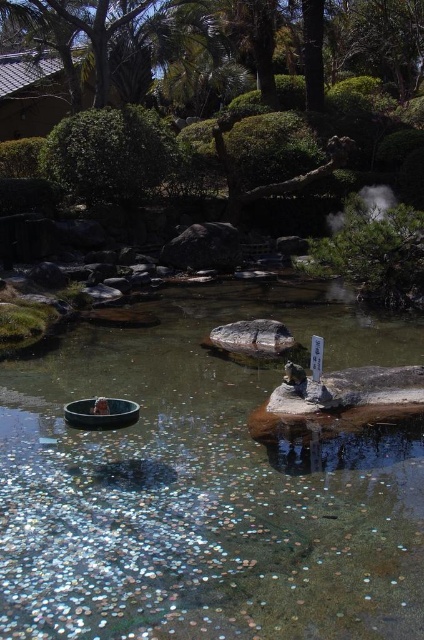
You are a visitor at the hot spring and want to place a small souvenir on the rocks near the water. Which rock would be more stable for placing your souvenir, the dark gray rock at center or the smooth gray rock at center?

The dark gray rock at center is larger and therefore more stable for placing your souvenir compared to the smooth gray rock at center.

You are a visitor at this hot spring and want to place a small offering into the clear glass water at center. However, you notice the dark gray rock at center nearby. Which object is larger in size, making it more suitable for placing larger offerings?

The dark gray rock at center is larger than the clear glass water at center, so it is more suitable for placing larger offerings.